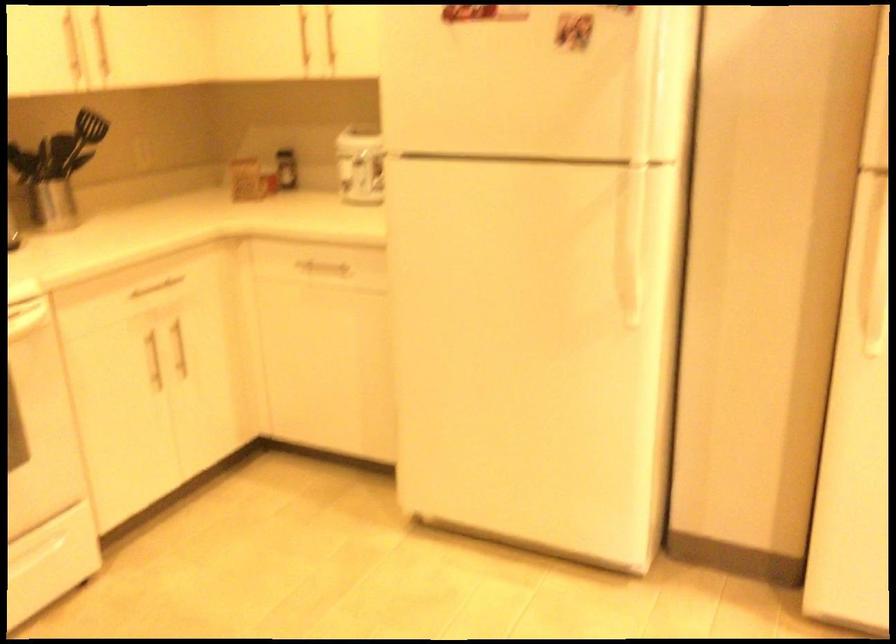
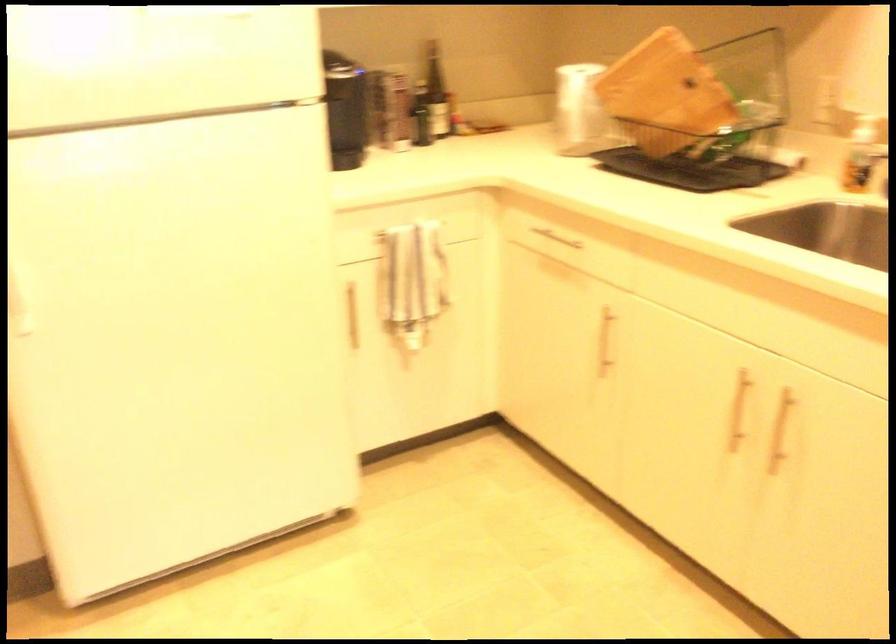
Question: The first image is from the beginning of the video and the second image is from the end. How did the camera likely rotate when shooting the video?

Choices:
 (A) Left
 (B) Right
 (C) Up
 (D) Down

Answer: (B)